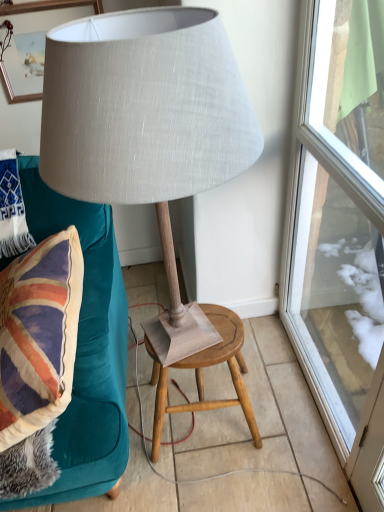
Find the location of a particular element. vacant space to the right of wooden stool at center is located at coordinates (290, 410).